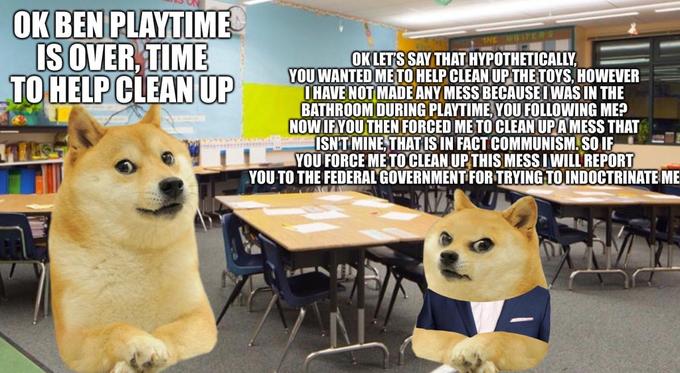
Where is `shelf`? shelf is located at coordinates (29, 137).